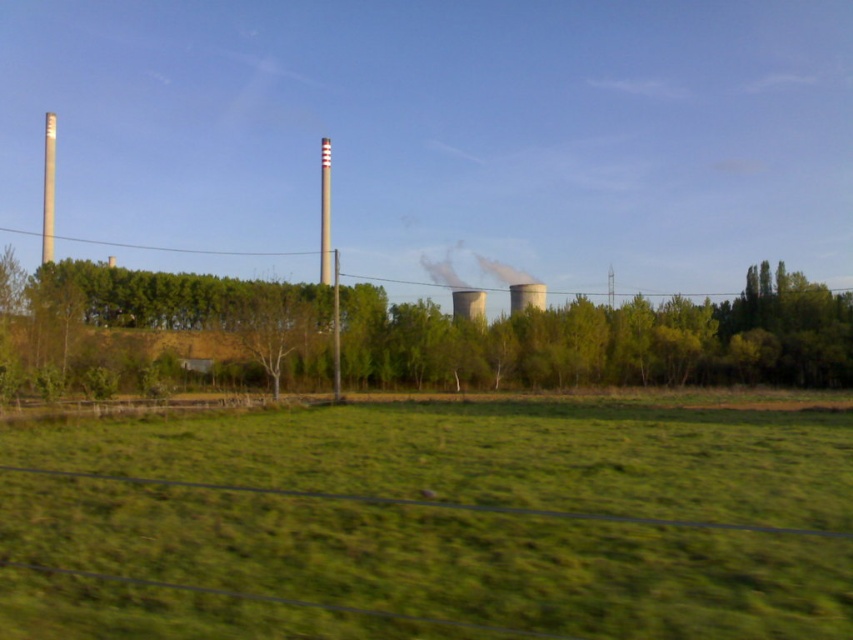
Question: Which object is the farthest from the smoketransparentsteam at center?

Choices:
 (A) green grass at center
 (B) smooth white pole at center
 (C) green leafy tree at center

Answer: (A)

Question: Which of the following is the closest to the observer?

Choices:
 (A) smoketransparentsteam at center
 (B) smooth white pole at center
 (C) green grass at center
 (D) green leafy tree at center

Answer: (C)

Question: Is green leafy tree at center thinner than smoketransparentsteam at center?

Choices:
 (A) yes
 (B) no

Answer: (B)

Question: Considering the real-world distances, which object is farthest from the smoketransparentsteam at center?

Choices:
 (A) green leafy tree at center
 (B) green grass at center

Answer: (B)

Question: Does smoketransparentsteam at center appear on the left side of smooth white pole at center?

Choices:
 (A) no
 (B) yes

Answer: (A)

Question: Does green leafy tree at center have a greater width compared to smoketransparentsteam at center?

Choices:
 (A) no
 (B) yes

Answer: (B)